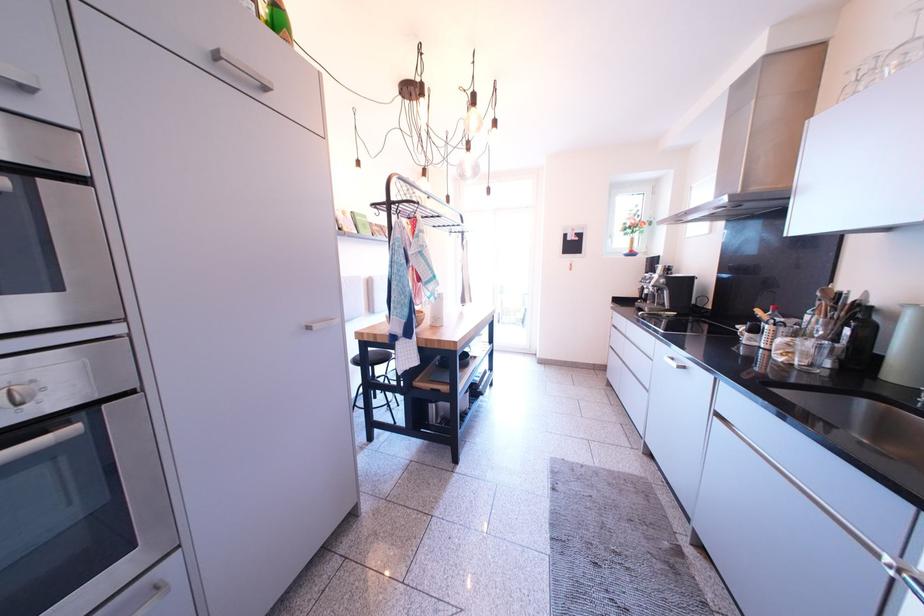
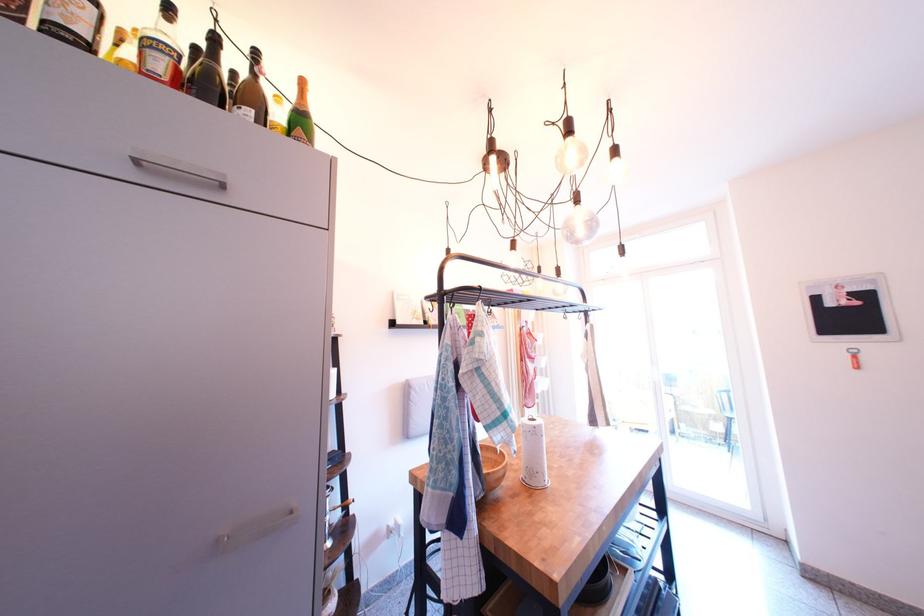
The point at (480,167) is marked in the first image. Where is the corresponding point in the second image?

(590, 222)